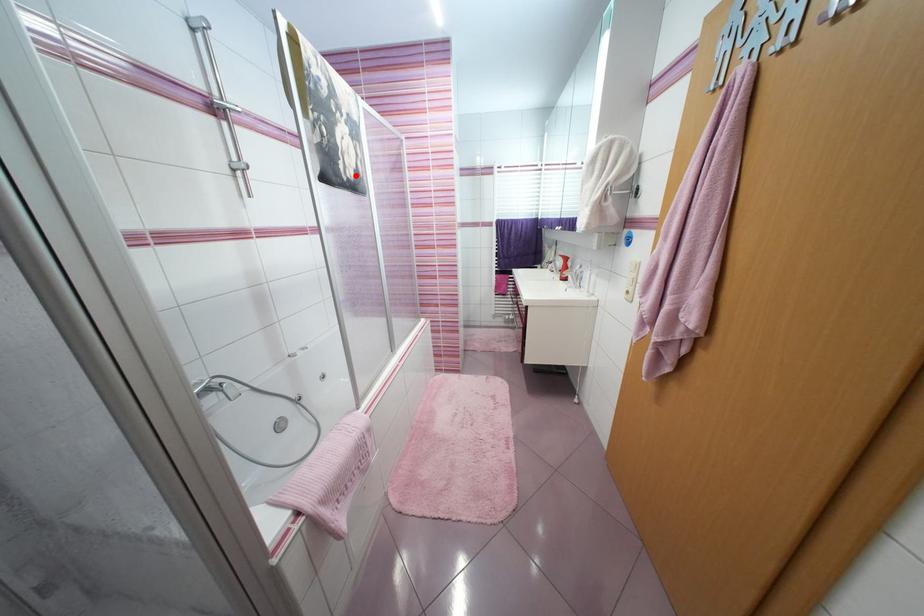
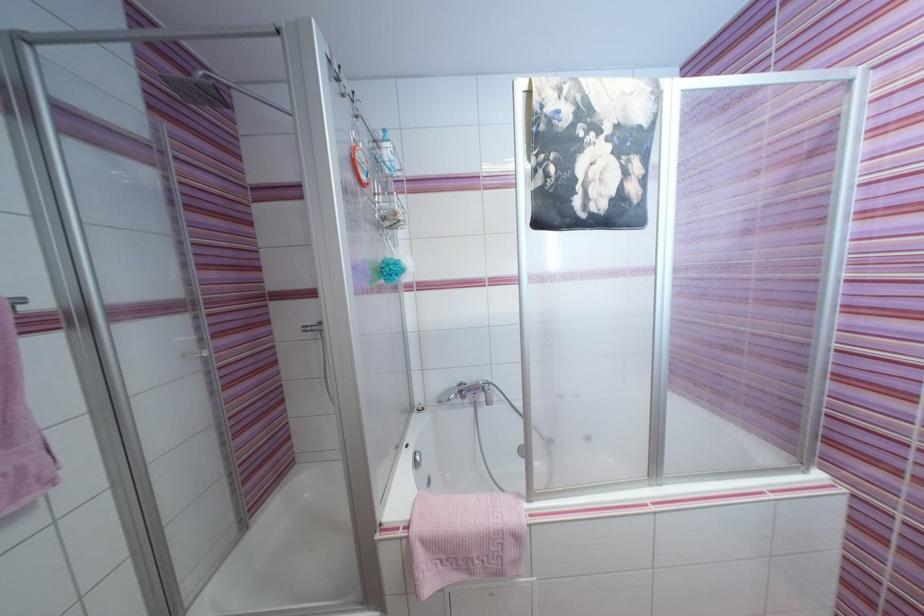
Where in the second image is the point corresponding to the highlighted location from the first image?

(604, 208)